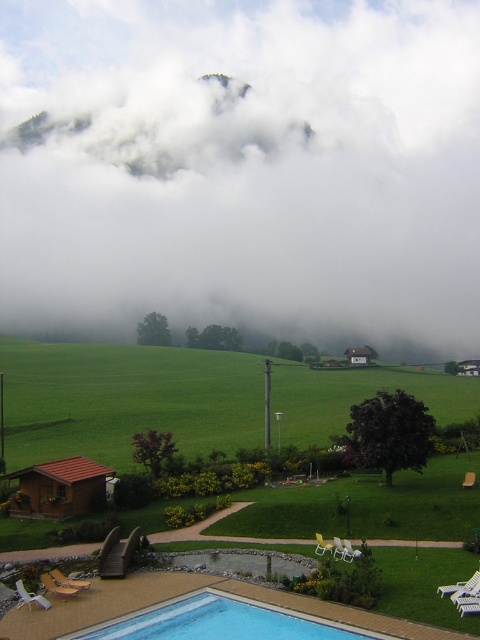
Is green grassy hillside at lower left positioned before blue tile swimming pool at lower center?

No, it is not.

Does green grassy hillside at lower left appear over blue tile swimming pool at lower center?

Indeed, green grassy hillside at lower left is positioned over blue tile swimming pool at lower center.

Locate an element on the screen. green grassy hillside at lower left is located at coordinates (126, 400).

Locate an element on the screen. The image size is (480, 640). green grassy hillside at lower left is located at coordinates [x=126, y=400].

Is white fluffy cloud at upper center thinner than blue tile swimming pool at lower center?

No, white fluffy cloud at upper center is not thinner than blue tile swimming pool at lower center.

Based on the photo, is white fluffy cloud at upper center wider than blue tile swimming pool at lower center?

Indeed, white fluffy cloud at upper center has a greater width compared to blue tile swimming pool at lower center.

Find the location of a particular element. Image resolution: width=480 pixels, height=640 pixels. white fluffy cloud at upper center is located at coordinates (242, 164).

Is white fluffy cloud at upper center shorter than green grassy hillside at lower left?

No, white fluffy cloud at upper center is not shorter than green grassy hillside at lower left.

Can you confirm if white fluffy cloud at upper center is bigger than green grassy hillside at lower left?

Yes.

Between point (335, 228) and point (214, 365), which one is positioned behind?

The point (335, 228) is more distant.

At what (x,y) coordinates should I click in order to perform the action: click on white fluffy cloud at upper center. Please return your answer as a coordinate pair (x, y). The image size is (480, 640). Looking at the image, I should click on (242, 164).